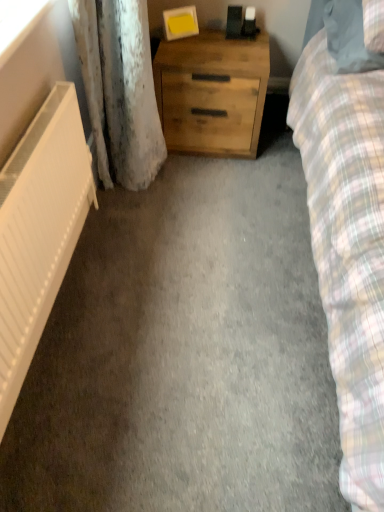
You are a GUI agent. You are given a task and a screenshot of the screen. Output one action in this format:
    pyautogui.click(x=<x>, y=<y>)
    Task: Click on the free location above natural wood chest of drawers at center (from a real-world perspective)
    
    Given the screenshot: What is the action you would take?
    pyautogui.click(x=223, y=40)